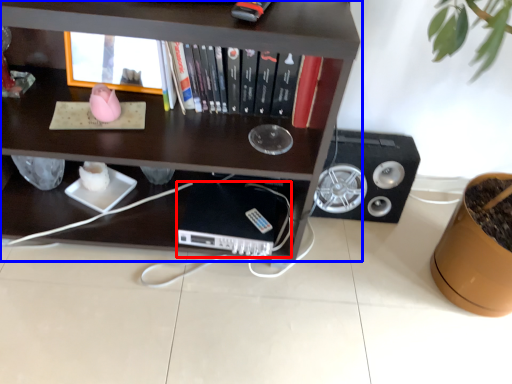
Question: Which point is further to the camera, computer (highlighted by a red box) or shelf (highlighted by a blue box)?

Choices:
 (A) computer
 (B) shelf

Answer: (A)